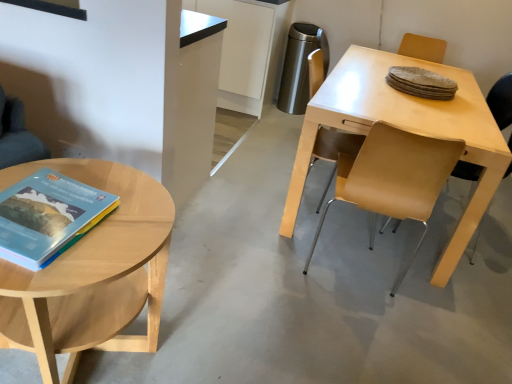
Find the location of a particular element. The height and width of the screenshot is (384, 512). vacant area that lies to the right of matte hardcover book at left is located at coordinates (123, 238).